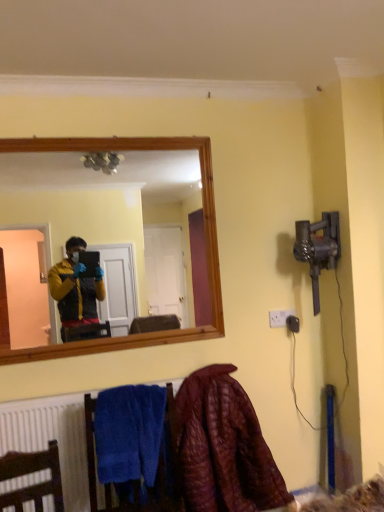
Question: In the image, is white plastic electric outlet at lower right positioned in front of or behind blue soft towel at lower left?

Choices:
 (A) front
 (B) behind

Answer: (B)

Question: From a real-world perspective, is white plastic electric outlet at lower right physically located above or below blue soft towel at lower left?

Choices:
 (A) above
 (B) below

Answer: (A)

Question: Estimate the real-world distances between objects in this image. Which object is closer to the velvet maroon blanket at lower right?

Choices:
 (A) white plastic electric outlet at lower right
 (B) blue soft towel at lower left

Answer: (B)

Question: Based on their relative distances, which object is nearer to the white plastic electric outlet at lower right?

Choices:
 (A) blue soft towel at lower left
 (B) velvet maroon blanket at lower right

Answer: (B)